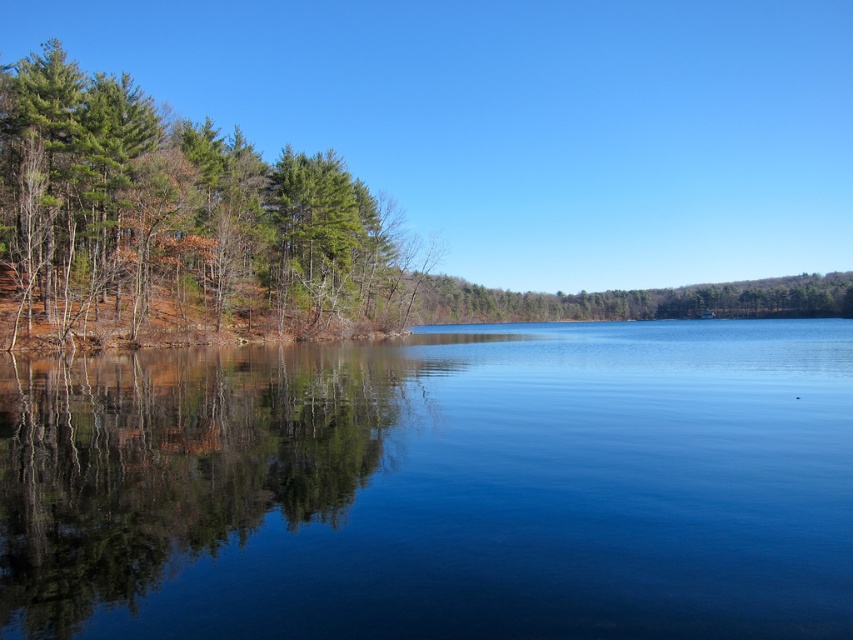
You are standing at the lakeside and notice two points on the water surface. The first point is labeled as point (x=640, y=342) and the second as point (x=289, y=381). Which of these two points is closer to your position?

Point (x=289, y=381) is closer to your position because it is nearer to the camera compared to point (x=640, y=342).

From the picture: You are standing at the lakeside and see the green matte tree at left and the green matte trees at left. Which one is bigger?

The green matte tree at left is larger in size compared to the green matte trees at left.

You are standing at the point marked by the coordinates point (178, 225) in the image. Looking around, you see the green matte tree at left. Which direction would you face to look towards the green matte tree at left?

Since you are standing at point (178, 225) which marks the green matte tree at left, you are already at the location of the green matte tree at left. Therefore, you don not need to face any direction to look towards it as you are already there.